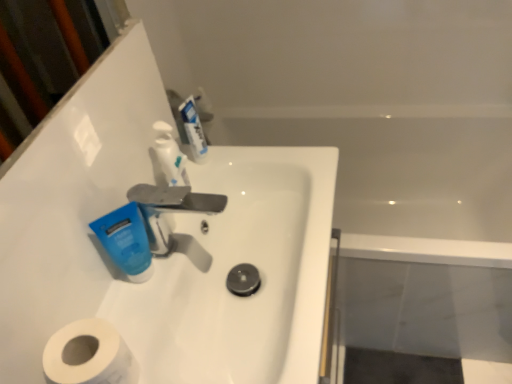
Identify the location of spots to the right of white glossy mouthwash at upper center, the 2th mouthwash in the bottom-to-top sequence. This screenshot has width=512, height=384. (269, 166).